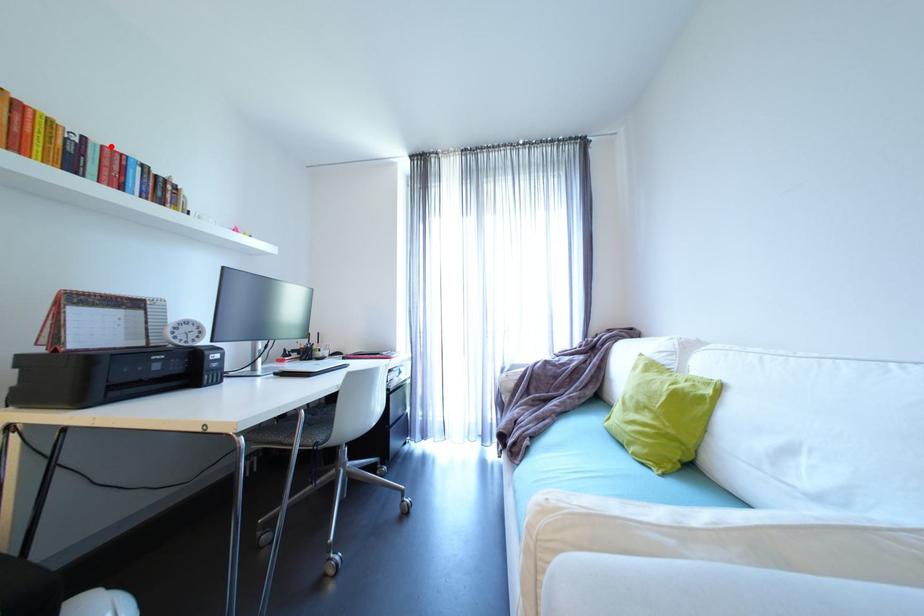
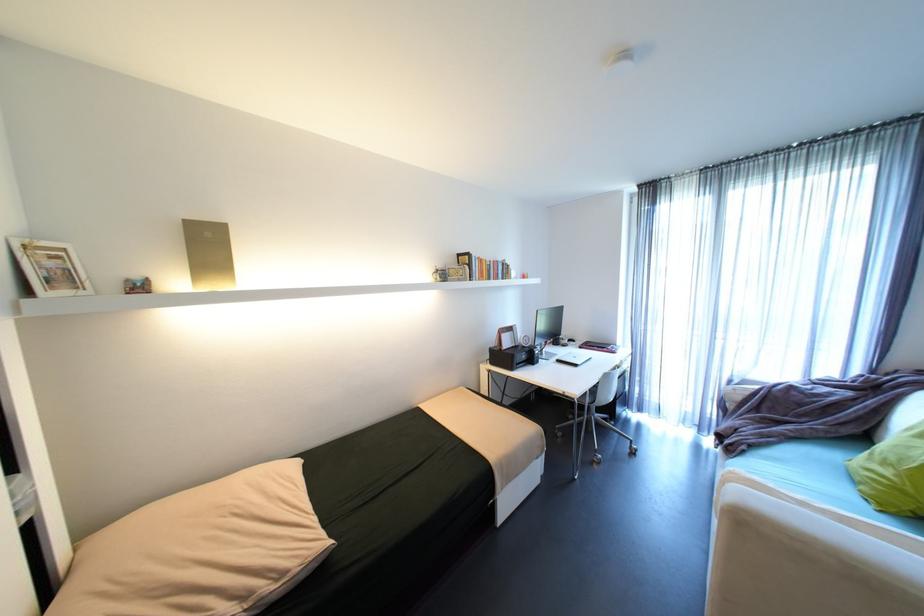
In the second image, find the point that corresponds to the highlighted location in the first image.

(500, 262)